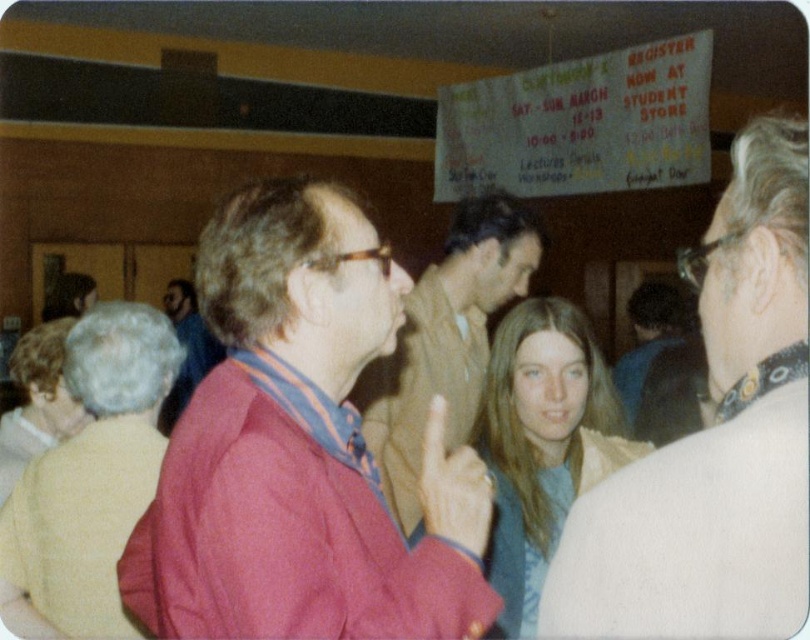
You are standing in the hallway and need to locate the matte red jacket at center. According to the coordinates provided, where should you look relative to the image frame?

The matte red jacket at center is located at coordinates point 0.705 on the x axis and 0.372 on the y axis, so you should look towards the right side and lower middle area of the image frame.

You are taking a photo of the two points in the image. The first point is at coordinates point (516, 205) and the second point is at point (698, 385). Which point will appear larger in your photo?

Point (516, 205) is closer to the camera than point (698, 385), so it will appear larger in the photo.